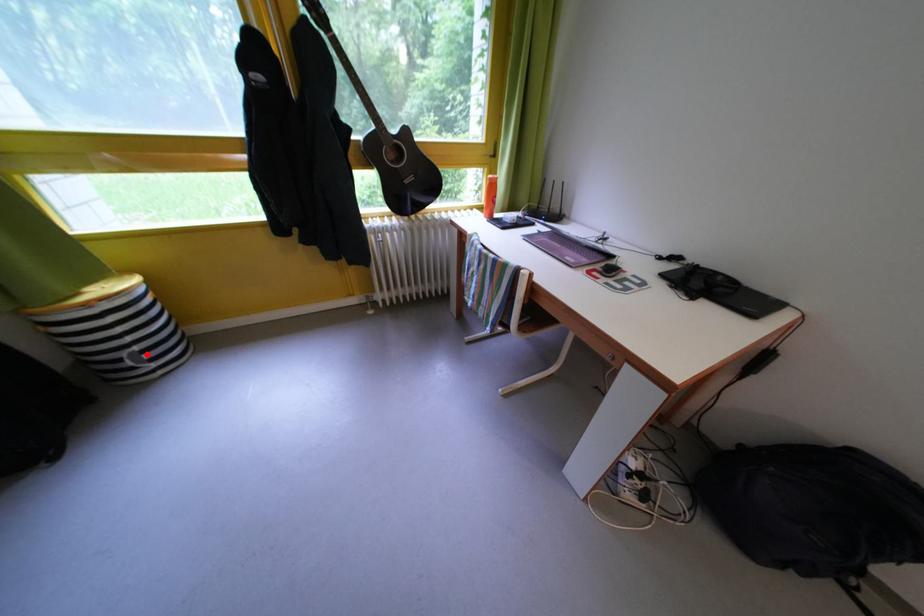
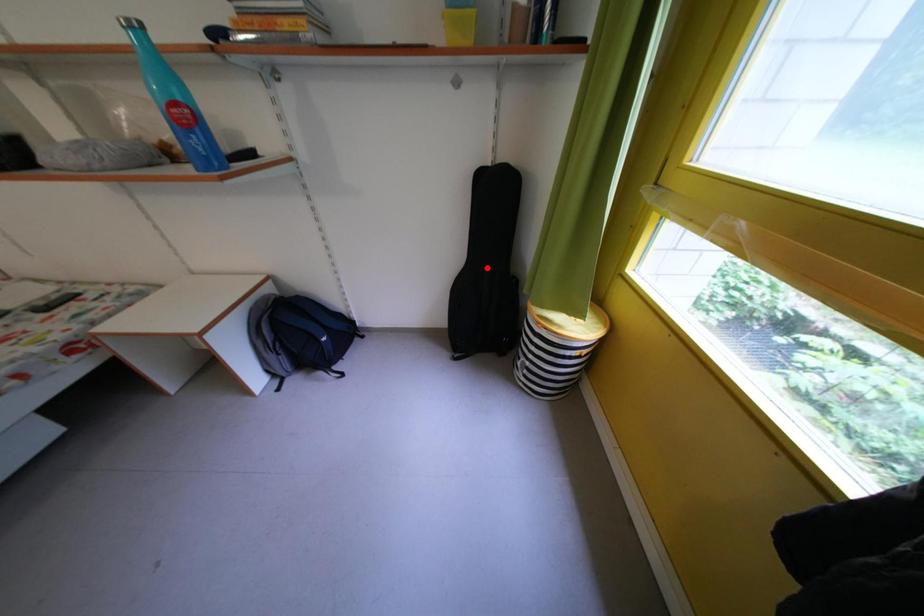
I am providing you with two images of the same scene from different viewpoints. A red point is marked on the first image and another point is marked on the second image. Does the point marked in image1 correspond to the same location as the one in image2?

No